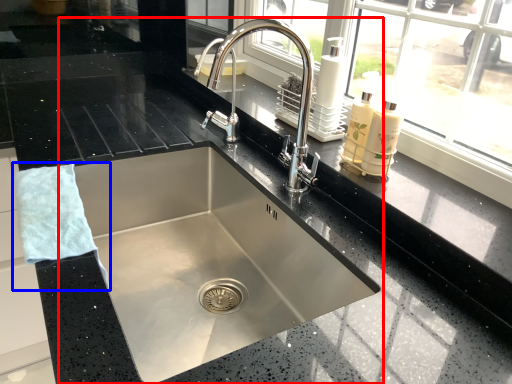
Question: Which object appears farthest to the camera in this image, sink (highlighted by a red box) or hand towel (highlighted by a blue box)?

Choices:
 (A) sink
 (B) hand towel

Answer: (B)